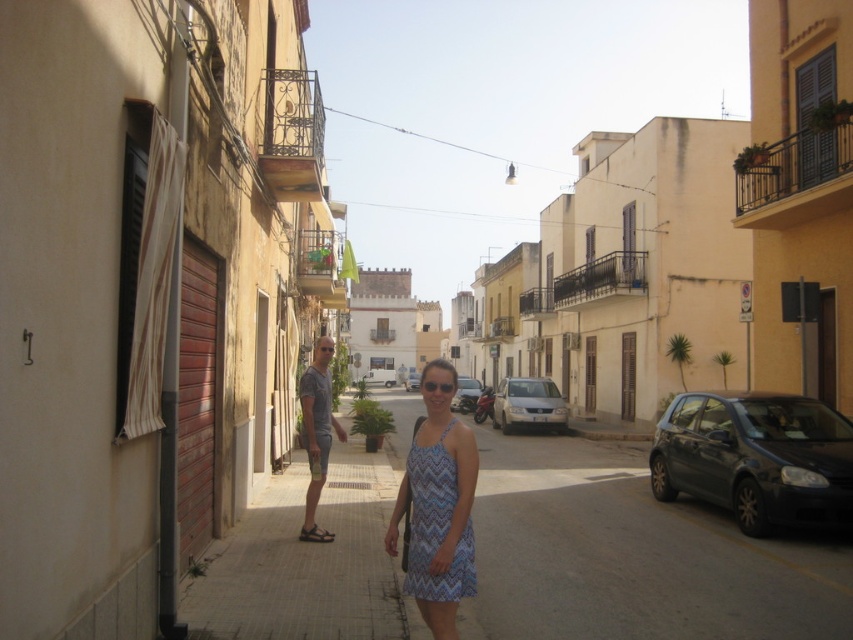
Question: Among these points, which one is nearest to the camera?

Choices:
 (A) (537, 401)
 (B) (467, 404)
 (C) (306, 534)

Answer: (C)

Question: Can you confirm if smooth concrete pavement at center is positioned to the right of metallic silver scooter at center?

Choices:
 (A) no
 (B) yes

Answer: (B)

Question: In this image, where is metallic silver scooter at center located relative to brown leather sandal at lower center?

Choices:
 (A) below
 (B) above

Answer: (B)

Question: Can you confirm if blue zigzag dress at center is positioned to the left of metallic silver car at center?

Choices:
 (A) yes
 (B) no

Answer: (B)

Question: Which object appears farthest from the camera in this image?

Choices:
 (A) brown leather sandal at lower center
 (B) metallic silver scooter at center

Answer: (A)

Question: Which is nearer to the silver metallic sedan at center?

Choices:
 (A) smooth concrete pavement at center
 (B) metallic silver car at center

Answer: (A)